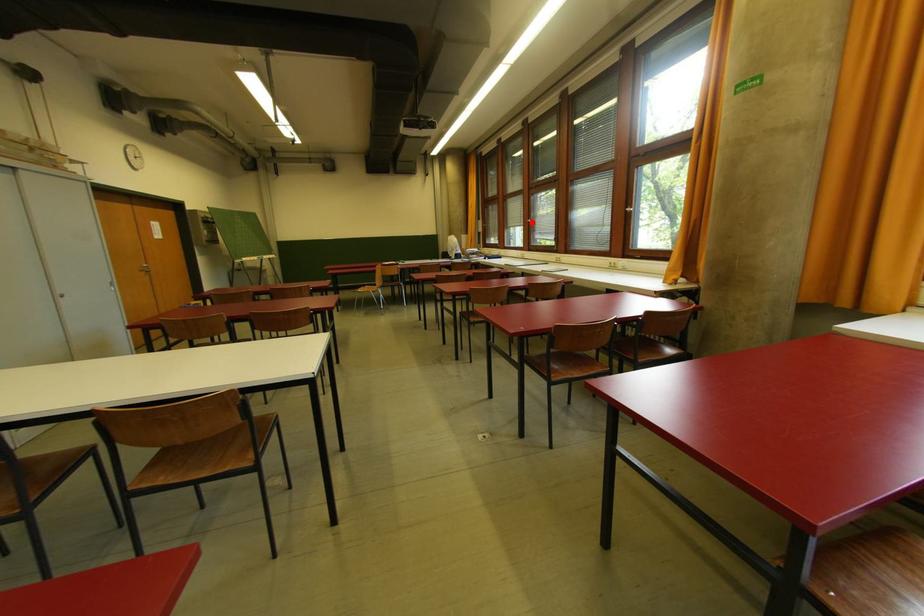
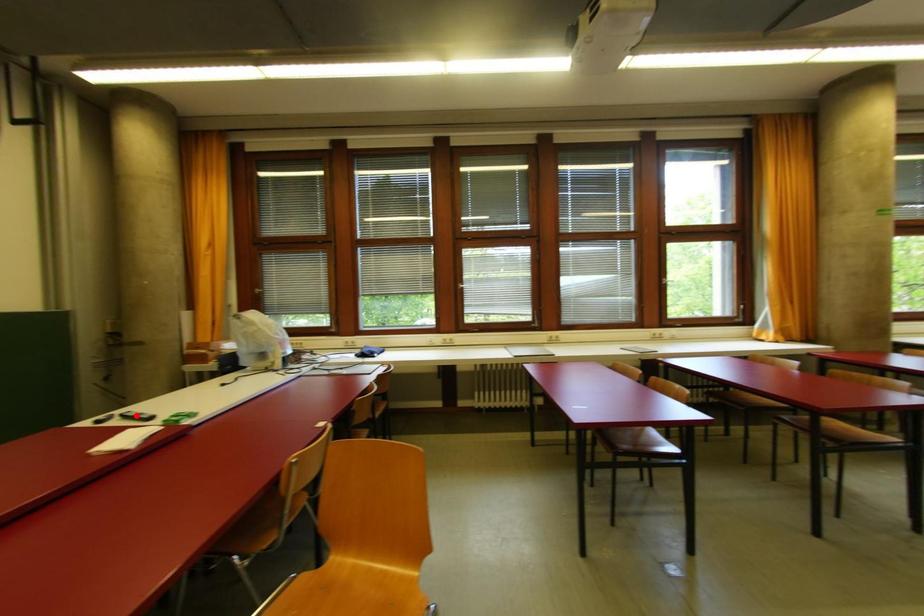
I am providing you with two images of the same scene from different viewpoints. A red point is marked on the first image and another point is marked on the second image. Is the marked point in image1 the same physical position as the marked point in image2?

No